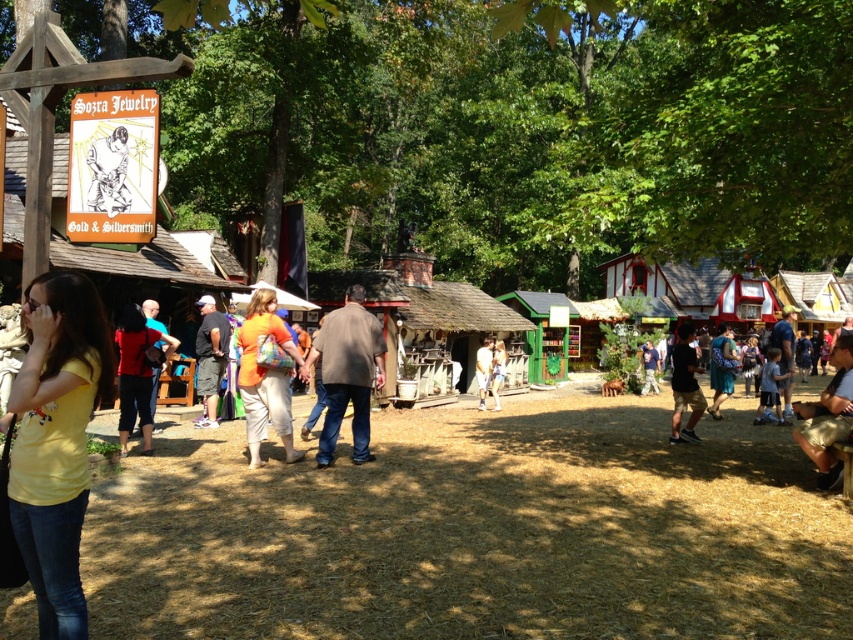
You are standing in the market and want to know which of the two points, point [55,589] or point [259,289], is nearer to you. Can you determine this based on the scene?

Point [55,589] is closer to the viewer than point [259,289], so it is nearer to you.